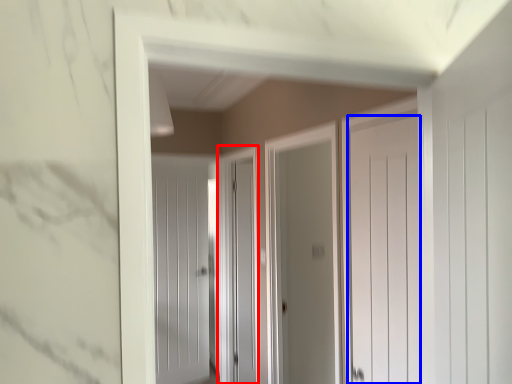
Question: Which object is further to the camera taking this photo, screen door (highlighted by a red box) or door (highlighted by a blue box)?

Choices:
 (A) screen door
 (B) door

Answer: (A)